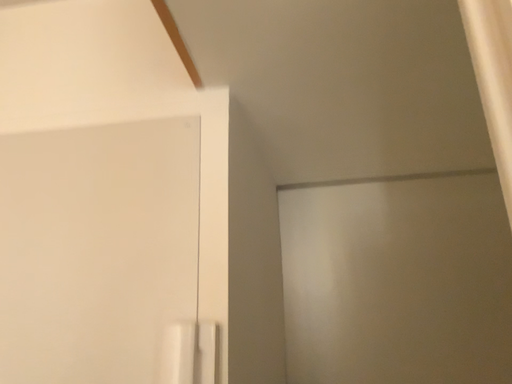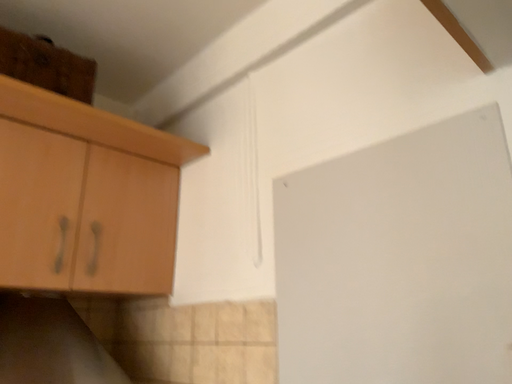
Question: Which way did the camera rotate in the video?

Choices:
 (A) rotated right
 (B) rotated left

Answer: (B)